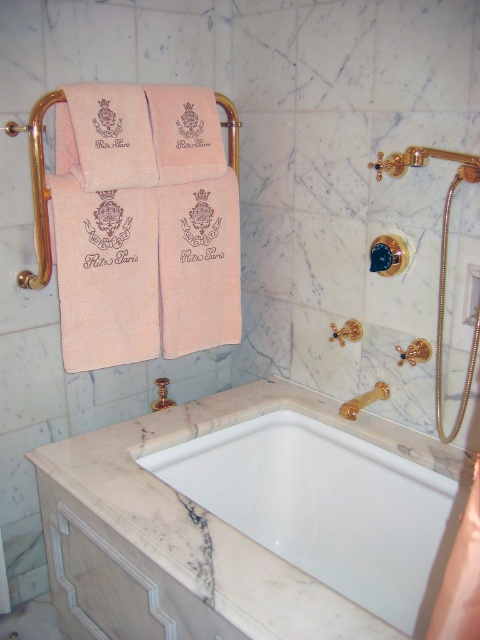
Question: Is pink cotton towel at center smaller than gold metallic shower handle at upper right?

Choices:
 (A) no
 (B) yes

Answer: (A)

Question: Is pink cotton towel at center closer to camera compared to gold metallic shower handle at upper right?

Choices:
 (A) yes
 (B) no

Answer: (B)

Question: Is pink cotton towel at center above gold metallic shower handle at upper right?

Choices:
 (A) no
 (B) yes

Answer: (B)

Question: Which object appears farthest from the camera in this image?

Choices:
 (A) gold metallic shower handle at upper right
 (B) pink cotton towel at center
 (C) white marble bathtub at center

Answer: (B)

Question: Which point is farther to the camera?

Choices:
 (A) pink cotton towel at center
 (B) gold metallic shower handle at upper right

Answer: (A)

Question: Which of the following is the closest to the observer?

Choices:
 (A) (237, 285)
 (B) (381, 602)
 (C) (375, 400)

Answer: (B)